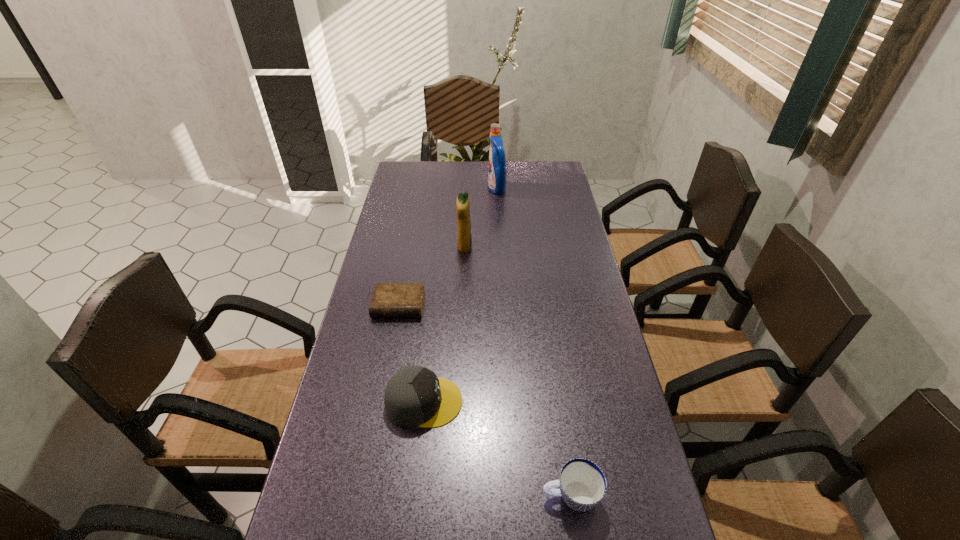
At what (x,y) coordinates should I click in order to perform the action: click on free space located 0.060m on the label of the fourth object from left to right. Please return your answer as a coordinate pair (x, y). The width and height of the screenshot is (960, 540). Looking at the image, I should click on (473, 188).

Find the location of `vacant space located on the label of the fourth object from left to right`. vacant space located on the label of the fourth object from left to right is located at coordinates (x=435, y=188).

What are the coordinates of `free space located 0.320m on the label of the second farthest object` in the screenshot? It's located at (564, 247).

Find the location of a particular element. The width and height of the screenshot is (960, 540). vacant region located 0.370m on the front-facing side of the fourth farthest object is located at coordinates (612, 402).

This screenshot has width=960, height=540. In order to click on blank space located on the side of the rightmost object with the handle in this screenshot , I will do `click(403, 496)`.

Where is `vacant space positioned on the side of the rightmost object with the handle`? This screenshot has height=540, width=960. vacant space positioned on the side of the rightmost object with the handle is located at coordinates (350, 496).

You are a GUI agent. You are given a task and a screenshot of the screen. Output one action in this format:
    pyautogui.click(x=<x>, y=<y>)
    Task: Click on the free spot located 0.170m on the side of the rightmost object with the handle
    
    Given the screenshot: What is the action you would take?
    pyautogui.click(x=461, y=496)

At what (x,y) coordinates should I click in order to perform the action: click on vacant space situated 0.170m on the spine side of the shortest object. Please return your answer as a coordinate pair (x, y). Looking at the image, I should click on (387, 368).

Identify the location of object located in the far edge section of the desktop. The height and width of the screenshot is (540, 960). (497, 162).

Where is `cap located in the left edge section of the desktop`? cap located in the left edge section of the desktop is located at coordinates (414, 396).